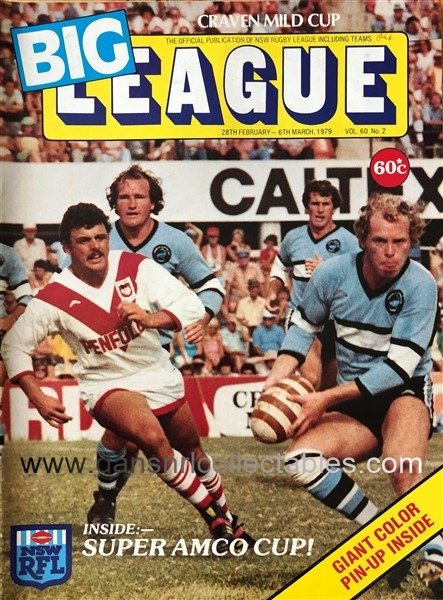
Find the location of a particular element. cup is located at coordinates (325, 18).